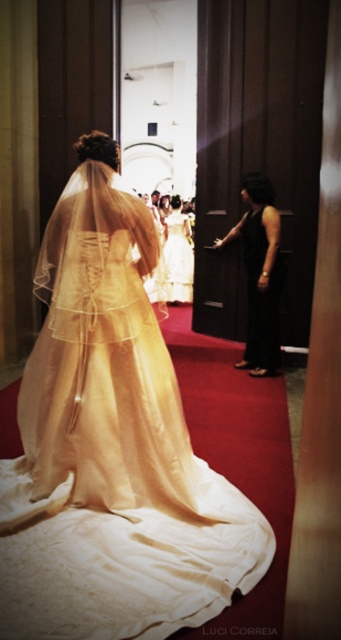
Question: Where is ivory satin gown at center located in relation to white satin dress at center in the image?

Choices:
 (A) below
 (B) above

Answer: (A)

Question: Can you confirm if ivory satin gown at center is positioned below black satin dress at right?

Choices:
 (A) yes
 (B) no

Answer: (A)

Question: In this image, where is black satin dress at right located relative to white satin dress at center?

Choices:
 (A) left
 (B) right

Answer: (B)

Question: Which object is the closest to the ivory satin gown at center?

Choices:
 (A) white satin dress at center
 (B) black satin dress at right

Answer: (B)

Question: Which object is closer to the camera taking this photo?

Choices:
 (A) black satin dress at right
 (B) ivory satin gown at center

Answer: (B)

Question: Which object is farther from the camera taking this photo?

Choices:
 (A) white satin dress at center
 (B) black satin dress at right

Answer: (A)